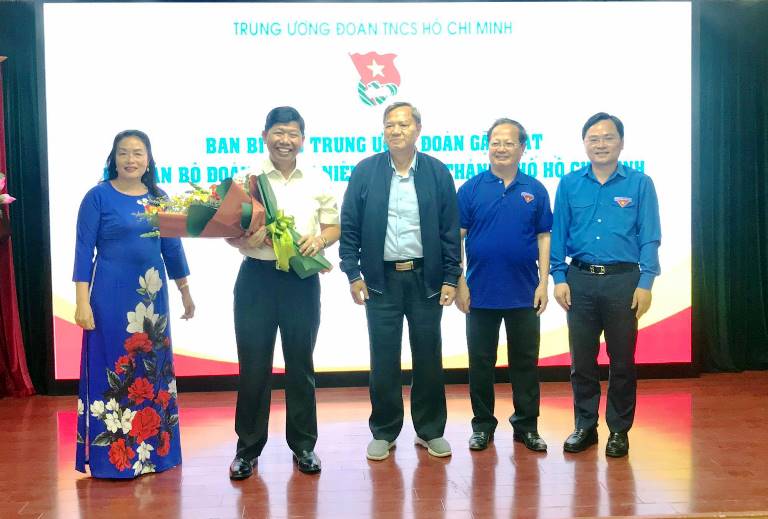
I want to click on bouquet, so click(242, 202).